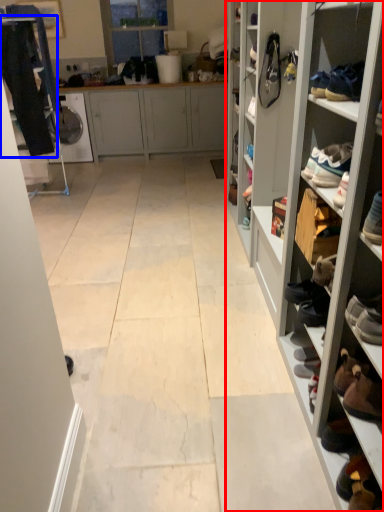
Question: Among these objects, which one is farthest to the camera, shelf (highlighted by a red box) or clothing (highlighted by a blue box)?

Choices:
 (A) shelf
 (B) clothing

Answer: (B)